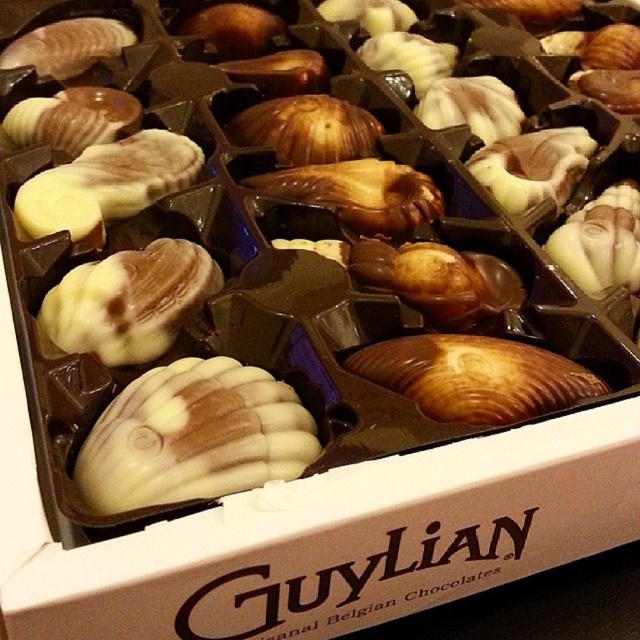
You are a customer at a store and want to buy the larger seashell chocolate. Looking at the box, which one should you choose between the white chocolate seashell at center and the matte brown seashell at center?

The matte brown seashell at center is larger since the white chocolate seashell at center has a smaller width than it.

You are holding the Guylian Belgian chocolate box and want to pick the white chocolate seashell at center without touching the matte brown seashell at center. Can you do it easily?

The white chocolate seashell at center is closer to the viewer than the matte brown seashell at center, so yes, you can easily pick the white chocolate seashell at center without touching the matte brown seashell at center.

You are a customer looking at the Guylian Belgian chocolate box. You see the white chocolate seashell at center and the matte brown seashell at center. Which one is positioned lower in the box?

The white chocolate seashell at center is positioned lower than the matte brown seashell at center because it is below it.